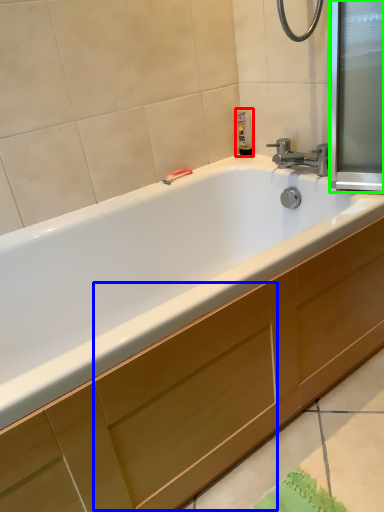
Question: Based on their relative distances, which object is nearer to soap dispenser (highlighted by a red box)? Choose from drawer (highlighted by a blue box) and screen door (highlighted by a green box).

Choices:
 (A) drawer
 (B) screen door

Answer: (B)